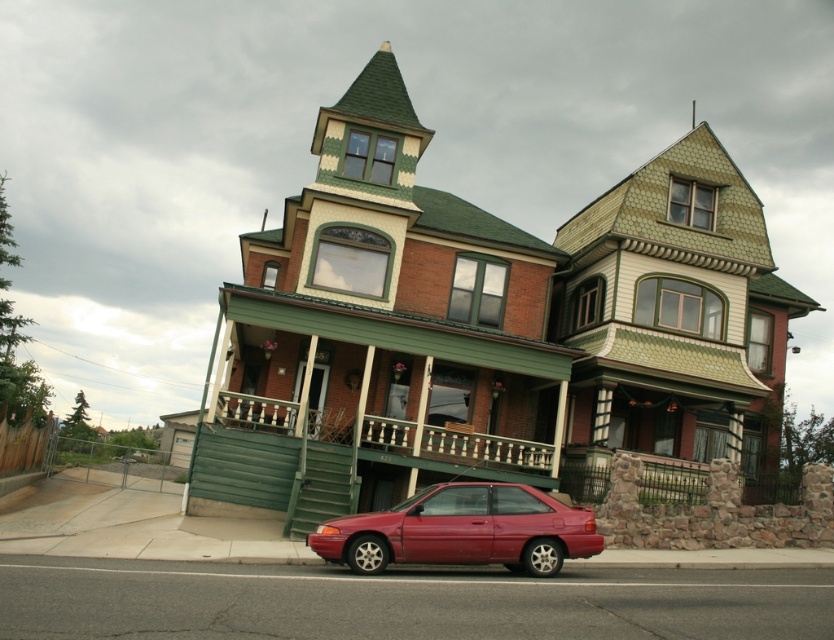
Is shiny red car at lower center above green painted wood porch at center?

Actually, shiny red car at lower center is below green painted wood porch at center.

Between point (533, 513) and point (466, 432), which one is positioned in front?

Point (533, 513) is more forward.

In order to click on shiny red car at lower center in this screenshot , I will do `click(461, 531)`.

Where is `shiny red car at lower center`? Image resolution: width=834 pixels, height=640 pixels. shiny red car at lower center is located at coordinates (461, 531).